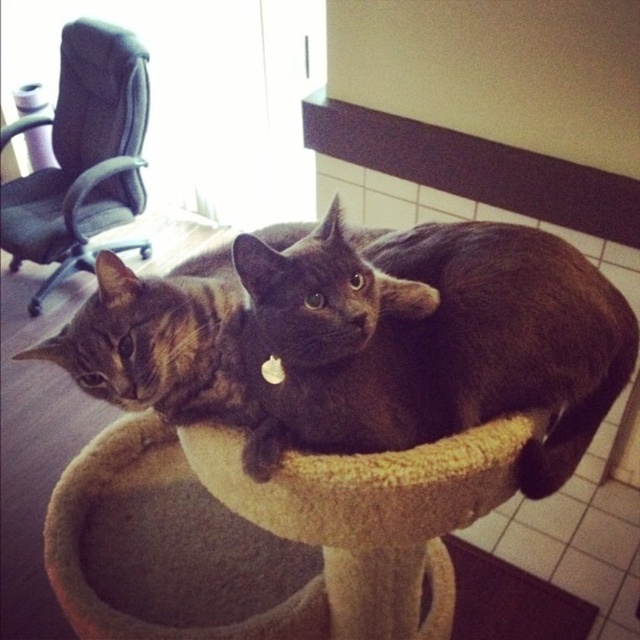
You are a cat owner who wants to place a new toy on the beige carpeted cat bed at center so that the shiny black cat at center can reach it easily. Based on the height of the cat bed and the cat, is this possible?

The beige carpeted cat bed at center is taller than the shiny black cat at center, so the toy placed on it may be too high for the cat to reach comfortably. Consider placing the toy lower down.

Consider the image. You are a cat owner who wants to ensure both cats have enough space on the cat tree. Given that the cat tree platform is circular and the shiny black cat at center is taking up more space than the tabby fur cat at center, can you determine which cat might need a larger area to rest comfortably?

The shiny black cat at center is larger in size than the tabby fur cat at center, so it would require a larger area to rest comfortably.